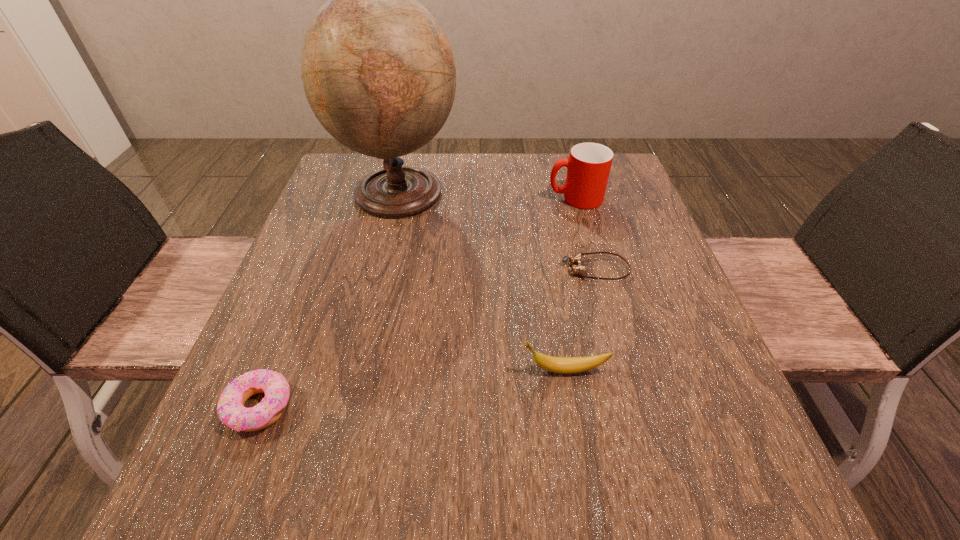
In the image, there is a desktop. Where is `free space at the right edge`? This screenshot has width=960, height=540. free space at the right edge is located at coordinates (687, 338).

Image resolution: width=960 pixels, height=540 pixels. Find the location of `vacant region between the banana and the second shortest object`. vacant region between the banana and the second shortest object is located at coordinates (412, 388).

Where is `vacant point located between the shortest object and the globe`? vacant point located between the shortest object and the globe is located at coordinates (497, 230).

Locate an element on the screen. free space between the nearest object and the fourth shortest object is located at coordinates (418, 302).

Locate an element on the screen. The image size is (960, 540). vacant region between the second shortest object and the cup is located at coordinates (418, 302).

Locate an element on the screen. The width and height of the screenshot is (960, 540). vacant area between the banana and the tallest object is located at coordinates (482, 281).

Image resolution: width=960 pixels, height=540 pixels. I want to click on free space between the tallest object and the fourth farthest object, so click(482, 281).

The width and height of the screenshot is (960, 540). I want to click on vacant point located between the fourth shortest object and the tallest object, so coord(488,195).

Find the location of a particular element. blank region between the second tallest object and the globe is located at coordinates (488, 195).

At what (x,y) coordinates should I click in order to perform the action: click on empty space that is in between the nearest object and the shortest object. Please return your answer as a coordinate pair (x, y). The width and height of the screenshot is (960, 540). Looking at the image, I should click on (427, 338).